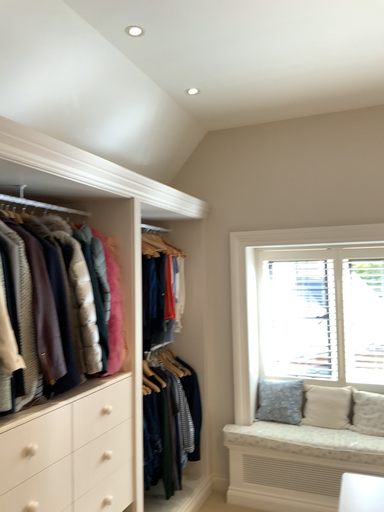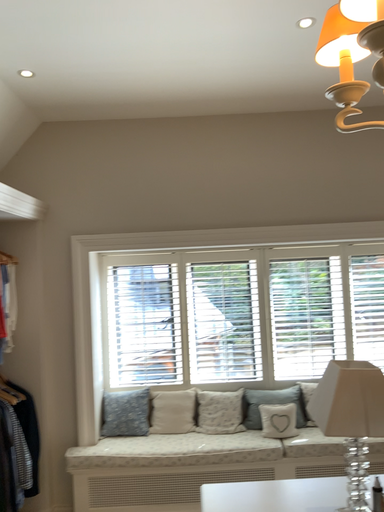
Question: How did the camera likely rotate when shooting the video?

Choices:
 (A) rotated left
 (B) rotated right

Answer: (B)